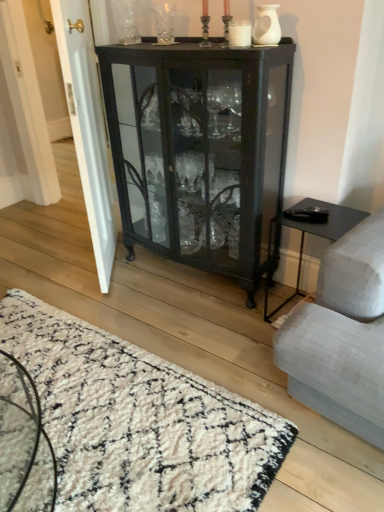
Where is `vacant space in black glass cabinet at center (from a real-world perspective)`? This screenshot has width=384, height=512. vacant space in black glass cabinet at center (from a real-world perspective) is located at coordinates click(x=192, y=279).